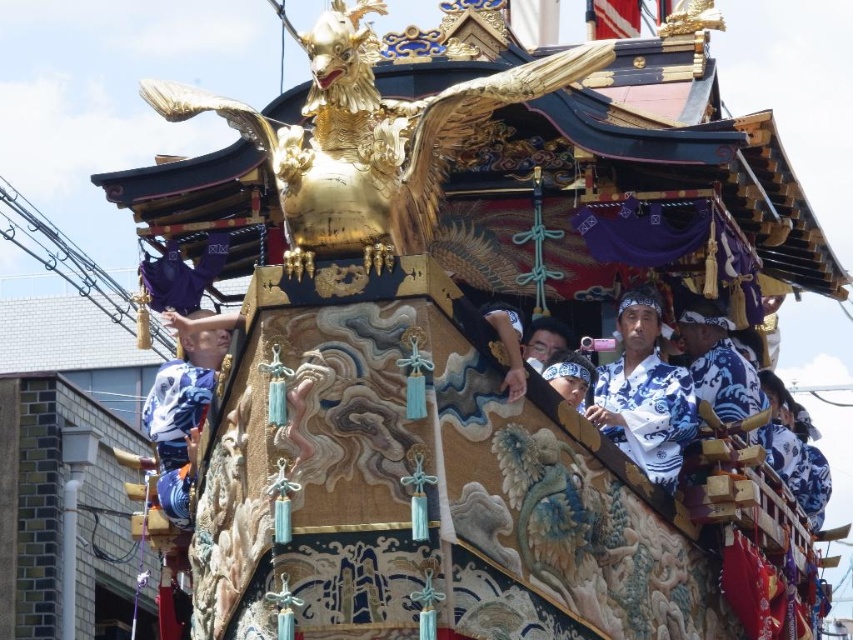
Which of these two, white cotton kimono at center or blue and white kimono at center, stands shorter?

white cotton kimono at center

Can you confirm if white cotton kimono at center is shorter than blue and white kimono at center?

Correct, white cotton kimono at center is not as tall as blue and white kimono at center.

Is point (606, 404) closer to camera compared to point (160, 477)?

Yes, it is in front of point (160, 477).

This screenshot has height=640, width=853. In order to click on white cotton kimono at center in this screenshot , I will do click(643, 394).